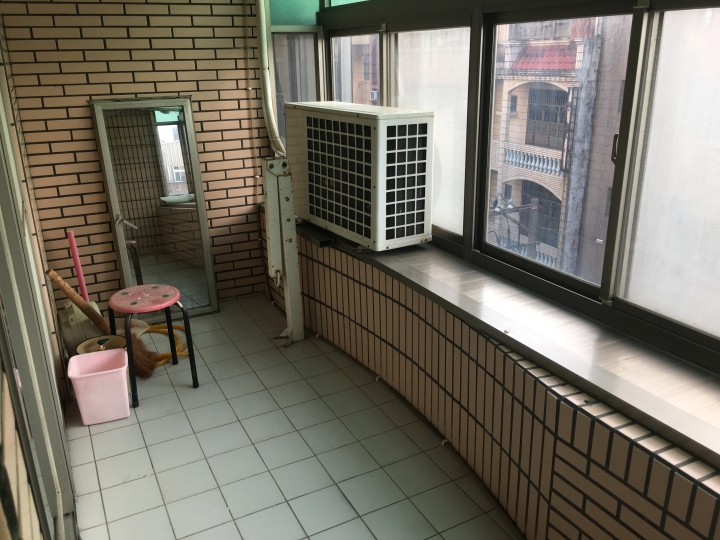
At what (x,y) coordinates should I click in order to perform the action: click on broom. Please return your answer as a coordinate pair (x, y). The image size is (720, 540). Looking at the image, I should click on (139, 354).